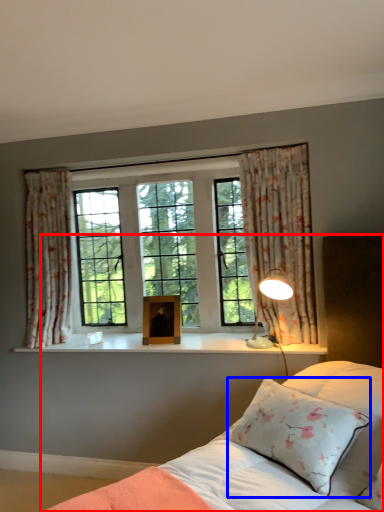
Question: Among these objects, which one is farthest to the camera, bed (highlighted by a red box) or pillow (highlighted by a blue box)?

Choices:
 (A) bed
 (B) pillow

Answer: (B)